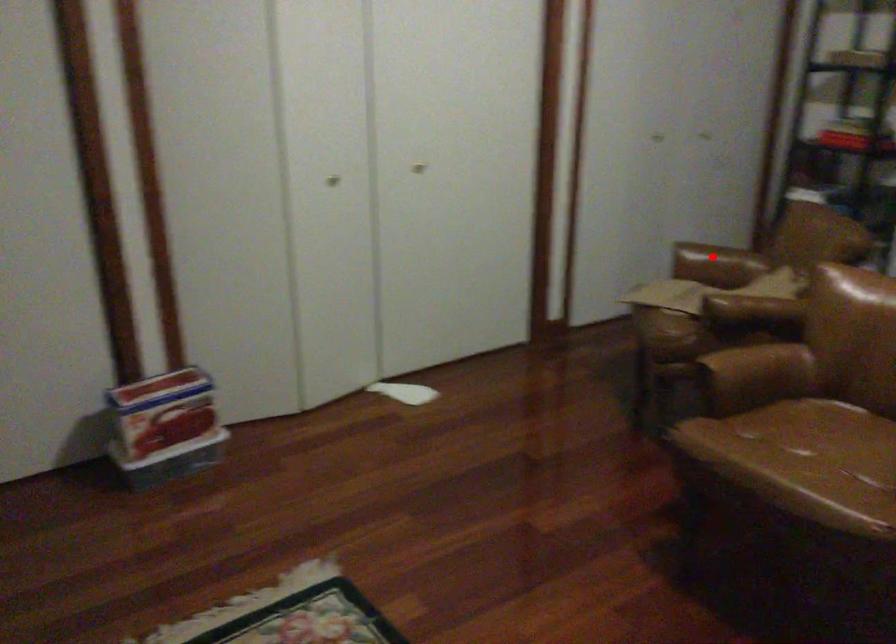
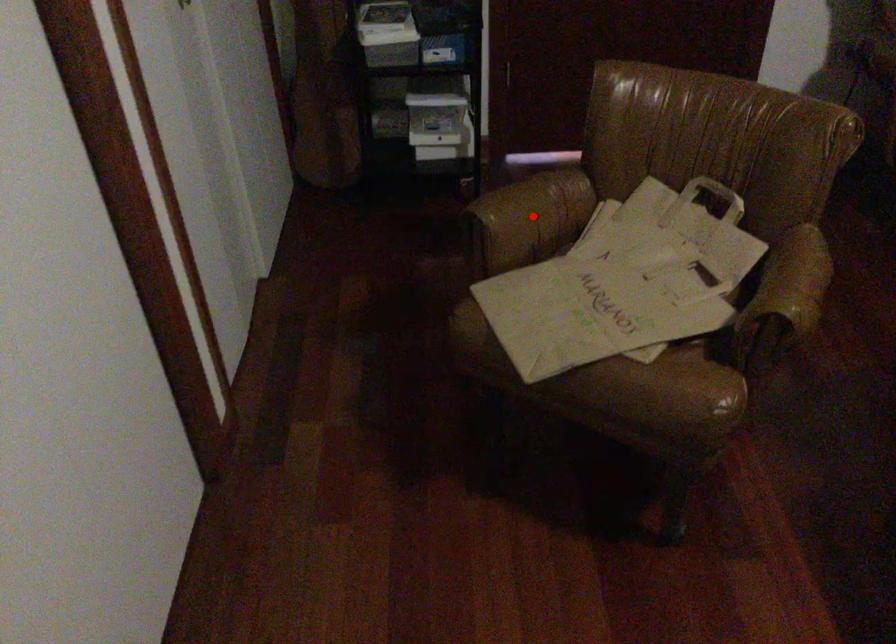
I am providing you with two images of the same scene from different viewpoints. A red point is marked on the first image and another point is marked on the second image. Is the red point in image1 aligned with the point shown in image2?

Yes